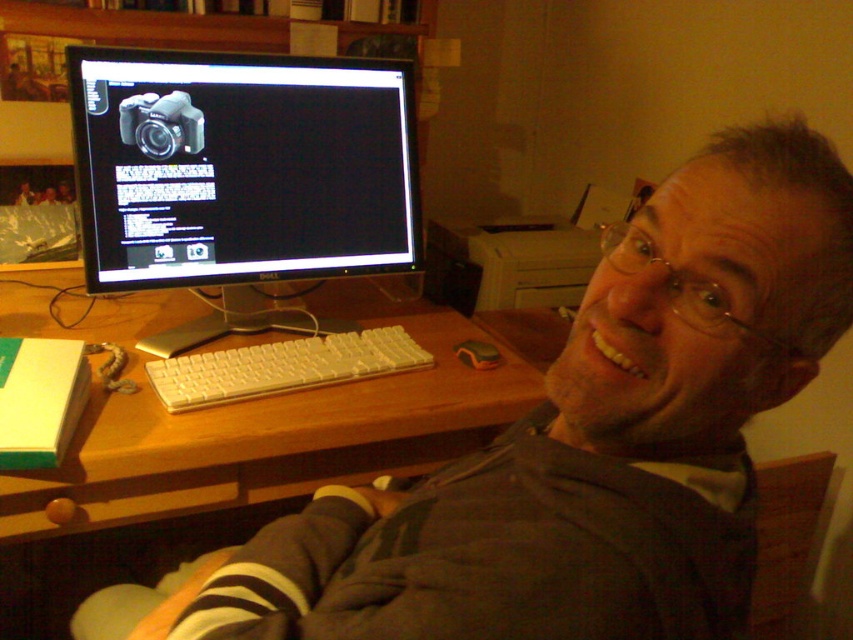
Question: Can you confirm if black glossy monitor at upper left is positioned to the left of wooden at center?

Choices:
 (A) no
 (B) yes

Answer: (B)

Question: Which object is closer to the camera taking this photo?

Choices:
 (A) wooden at center
 (B) white plastic keyboard at center
 (C) black glossy monitor at upper left

Answer: (A)

Question: Is black glossy monitor at upper left to the left of wooden at center from the viewer's perspective?

Choices:
 (A) no
 (B) yes

Answer: (B)

Question: Based on their relative distances, which object is nearer to the wooden at center?

Choices:
 (A) black glossy monitor at upper left
 (B) white plastic keyboard at center

Answer: (B)

Question: Which point is closer to the camera taking this photo?

Choices:
 (A) (461, 337)
 (B) (291, 376)
 (C) (113, 52)

Answer: (B)

Question: Does black glossy monitor at upper left appear on the left side of wooden at center?

Choices:
 (A) no
 (B) yes

Answer: (B)